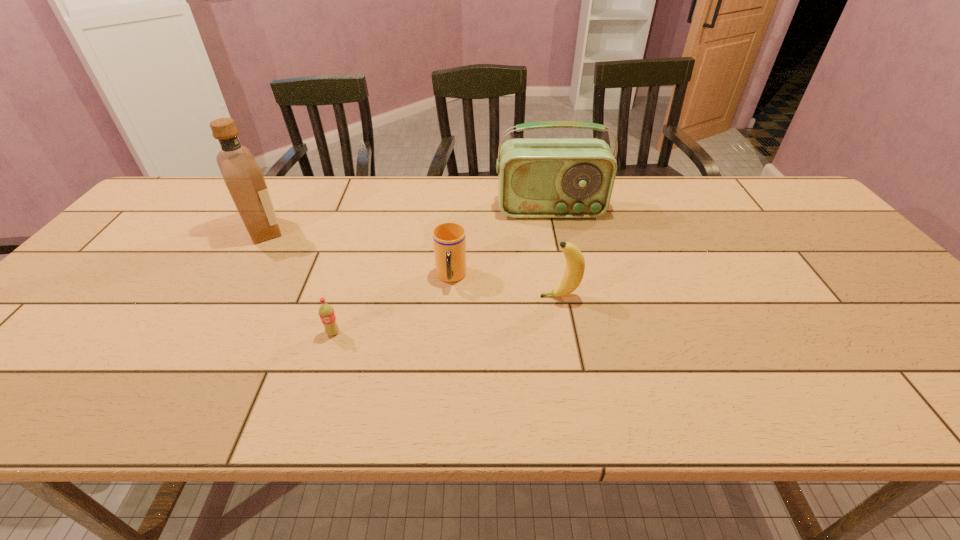
In order to click on the leftmost object in this screenshot , I will do `click(244, 179)`.

Locate an element on the screen. This screenshot has height=540, width=960. the tallest object is located at coordinates (244, 179).

At what (x,y) coordinates should I click in order to perform the action: click on radio receiver. Please return your answer as a coordinate pair (x, y). The height and width of the screenshot is (540, 960). Looking at the image, I should click on (537, 178).

Locate an element on the screen. The image size is (960, 540). the third shortest object is located at coordinates (575, 263).

This screenshot has height=540, width=960. Identify the location of the third object from right to left. (449, 240).

The image size is (960, 540). Identify the location of the second shortest object. (449, 240).

Where is `soda`? The height and width of the screenshot is (540, 960). soda is located at coordinates (326, 312).

The image size is (960, 540). What are the coordinates of `the shortest object` in the screenshot? It's located at (326, 312).

At what (x,y) coordinates should I click in order to perform the action: click on free space located 0.220m on the front-facing side of the liquor. Please return your answer as a coordinate pair (x, y). Image resolution: width=960 pixels, height=540 pixels. Looking at the image, I should click on (365, 230).

Image resolution: width=960 pixels, height=540 pixels. I want to click on vacant area situated on the front panel of the radio receiver, so click(x=556, y=238).